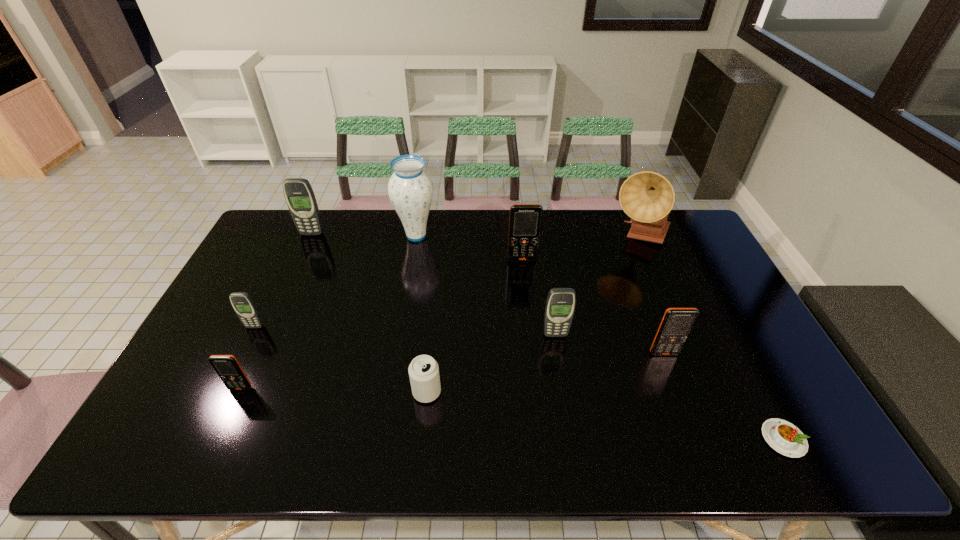
You are a GUI agent. You are given a task and a screenshot of the screen. Output one action in this format:
    pyautogui.click(x=<x>, y=<y>)
    Task: Click on the vacant space located on the screen of the biggest gray cellular telephone
    
    Given the screenshot: What is the action you would take?
    pyautogui.click(x=290, y=281)

The image size is (960, 540). In order to click on free space located 0.330m on the screen of the nearest gray cellular telephone in this screenshot , I will do `click(574, 449)`.

Locate an element on the screen. Image resolution: width=960 pixels, height=540 pixels. vacant space situated 0.280m on the screen of the seventh farthest object is located at coordinates (703, 457).

Where is `vacant region located on the screen of the nearest cellular telephone`? The width and height of the screenshot is (960, 540). vacant region located on the screen of the nearest cellular telephone is located at coordinates (212, 452).

Image resolution: width=960 pixels, height=540 pixels. What are the coordinates of `blank space located on the screen of the third farthest cellular telephone` in the screenshot? It's located at (222, 395).

At what (x,y) coordinates should I click in order to perform the action: click on free spot located on the right of the second shortest object. Please return your answer as a coordinate pair (x, y). The image size is (960, 540). Looking at the image, I should click on (500, 392).

At what (x,y) coordinates should I click in order to perform the action: click on phonograph record that is at the far edge. Please return your answer as a coordinate pair (x, y). Looking at the image, I should click on (647, 197).

Find the location of `vase present at the far edge`. vase present at the far edge is located at coordinates (410, 189).

Where is `cellular telephone present at the far edge`? This screenshot has height=540, width=960. cellular telephone present at the far edge is located at coordinates (299, 195).

You are a GUI agent. You are given a task and a screenshot of the screen. Output one action in this format:
    pyautogui.click(x=<x>, y=<y>)
    Task: Click on the object at the near edge
    
    Given the screenshot: What is the action you would take?
    pyautogui.click(x=784, y=437)